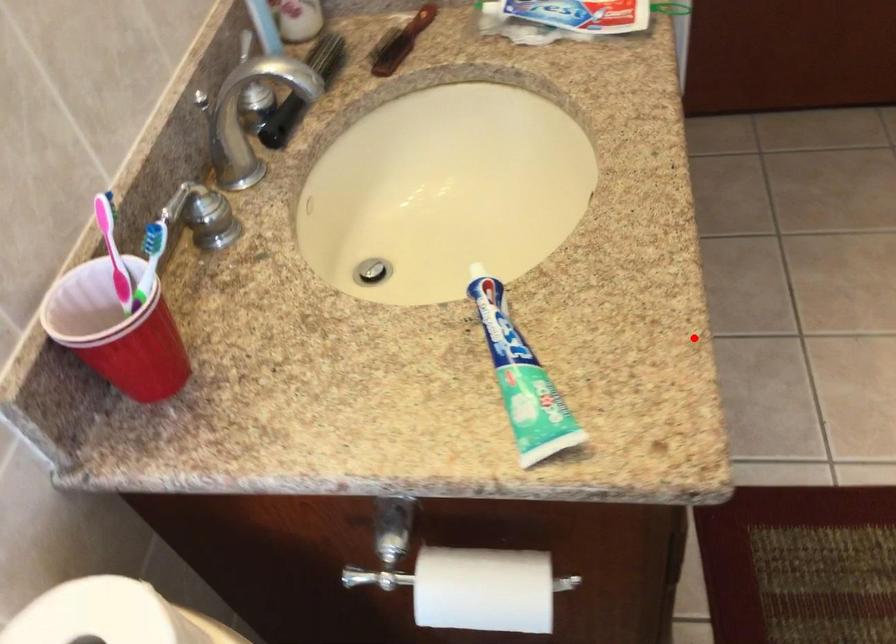
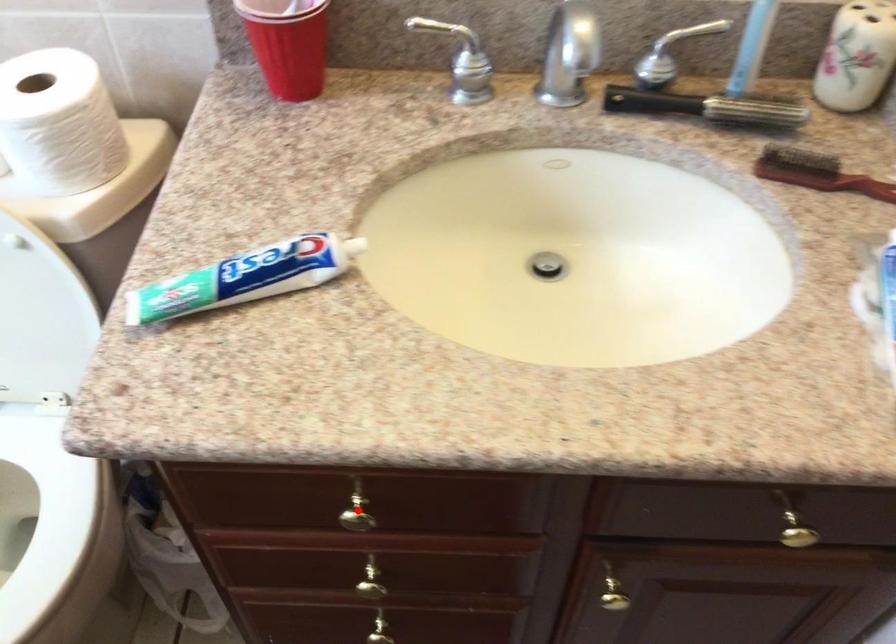
I am providing you with two images of the same scene from different viewpoints. A red point is marked on the first image and another point is marked on the second image. Are the points marked in image1 and image2 representing the same 3D position?

Yes